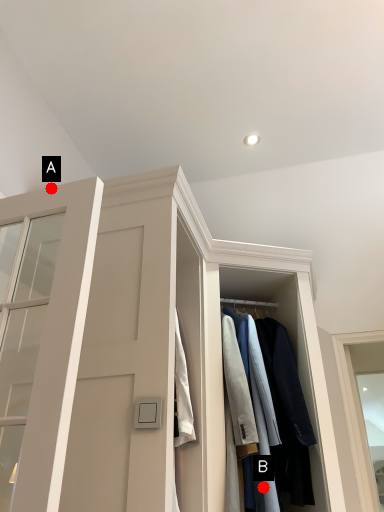
Question: Two points are circled on the image, labeled by A and B beside each circle. Which point appears closest to the camera in this image?

Choices:
 (A) A is closer
 (B) B is closer

Answer: (A)